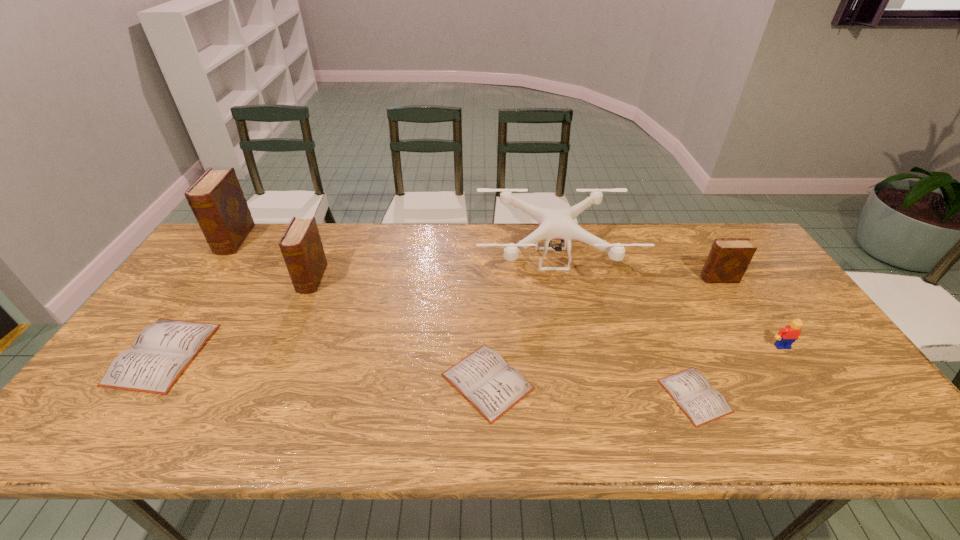
Where is `the fifth tallest diary`? The image size is (960, 540). the fifth tallest diary is located at coordinates (483, 378).

You are a GUI agent. You are given a task and a screenshot of the screen. Output one action in this format:
    pyautogui.click(x=<x>, y=<y>)
    Task: Click on the third diary from right to left
    
    Given the screenshot: What is the action you would take?
    pyautogui.click(x=483, y=378)

Identify the location of the rightmost white diary. Image resolution: width=960 pixels, height=540 pixels. (691, 391).

Where is `the fifth diary from left to right`? the fifth diary from left to right is located at coordinates (691, 391).

At what (x,y) coordinates should I click in order to perform the action: click on vacant region located 0.270m on the spine side of the tallest object. Please return your answer as a coordinate pair (x, y). The width and height of the screenshot is (960, 540). Looking at the image, I should click on (180, 317).

You are a GUI agent. You are given a task and a screenshot of the screen. Output one action in this format:
    pyautogui.click(x=<x>, y=<y>)
    Task: Click on the vacant space located 0.350m on the spine side of the second biggest brown diary
    The width and height of the screenshot is (960, 540).
    Given the screenshot: What is the action you would take?
    pyautogui.click(x=260, y=399)

This screenshot has height=540, width=960. I want to click on free space located 0.110m on the top of the gray drone, so click(x=564, y=322).

Identify the location of vacant area located 0.200m on the spine side of the smallest brown diary. Image resolution: width=960 pixels, height=540 pixels. (635, 279).

Image resolution: width=960 pixels, height=540 pixels. What are the coordinates of `blank area located on the spine side of the smallest brown diary` in the screenshot? It's located at (684, 279).

Image resolution: width=960 pixels, height=540 pixels. What are the coordinates of `free location located 0.160m on the spine side of the smallest brown diary` in the screenshot? It's located at (648, 279).